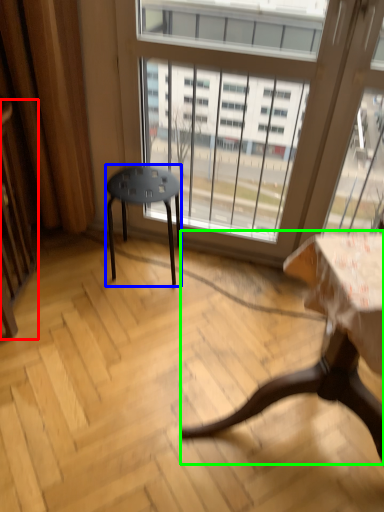
Question: Based on their relative distances, which object is farther from screen door (highlighted by a red box)? Choose from stool (highlighted by a blue box) and table (highlighted by a green box).

Choices:
 (A) stool
 (B) table

Answer: (B)